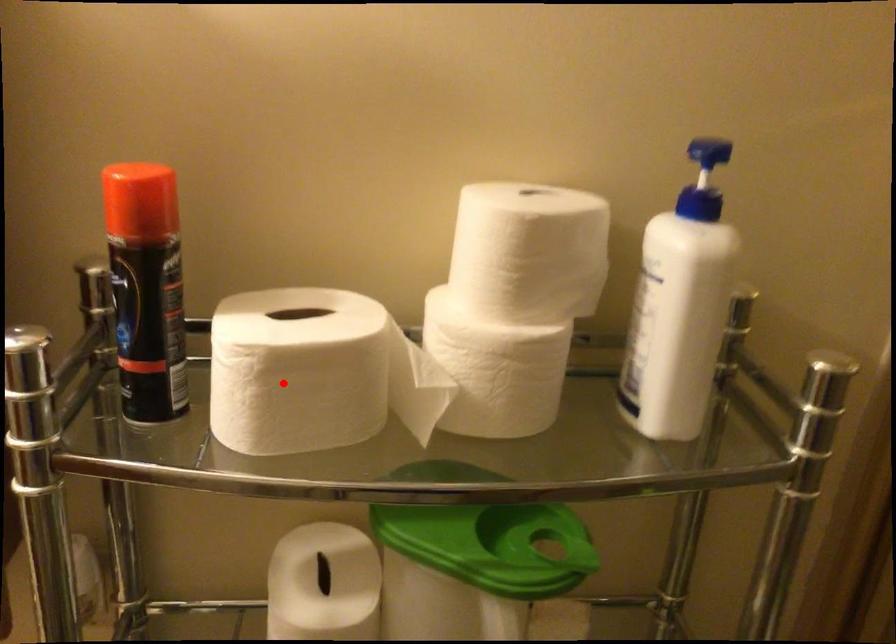
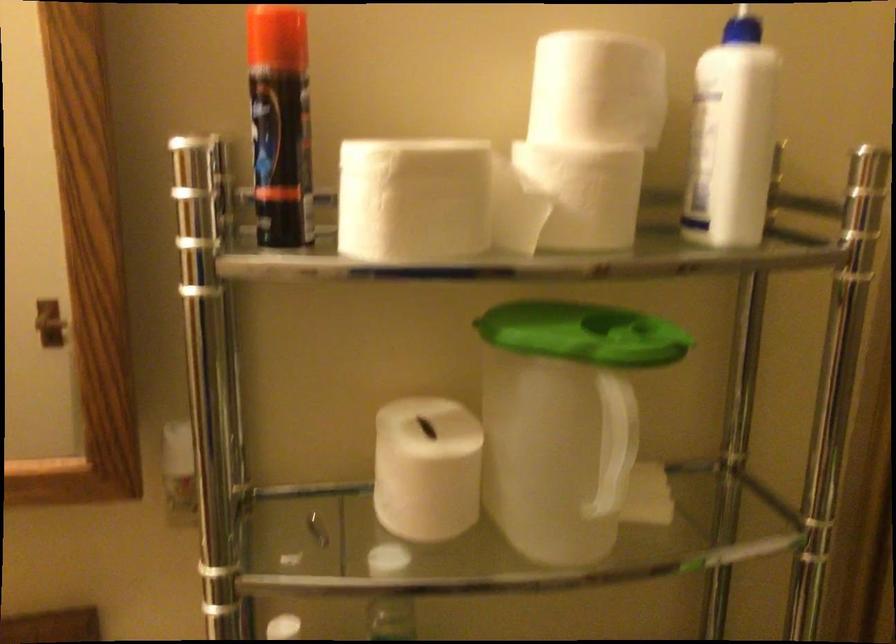
The point at the highlighted location is marked in the first image. Where is the corresponding point in the second image?

(412, 200)